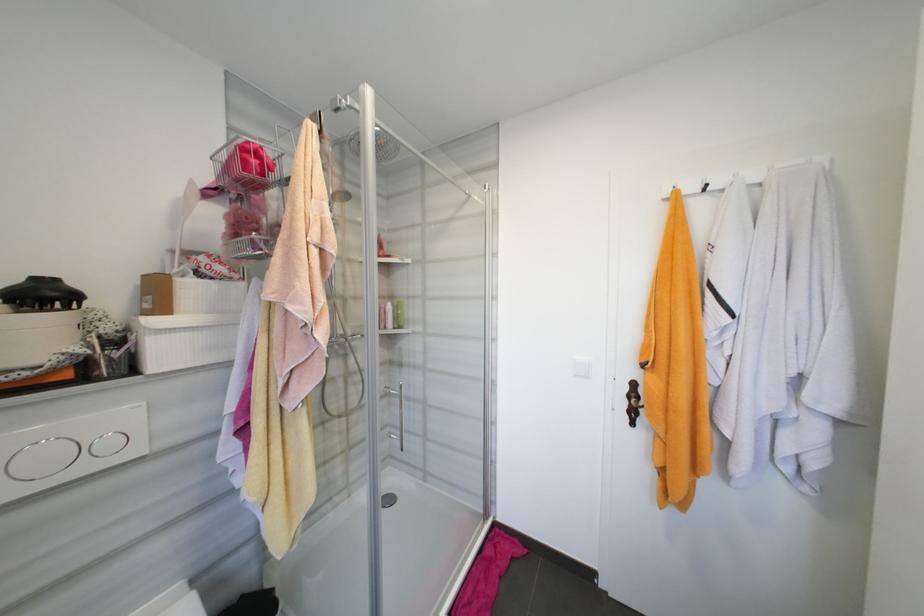
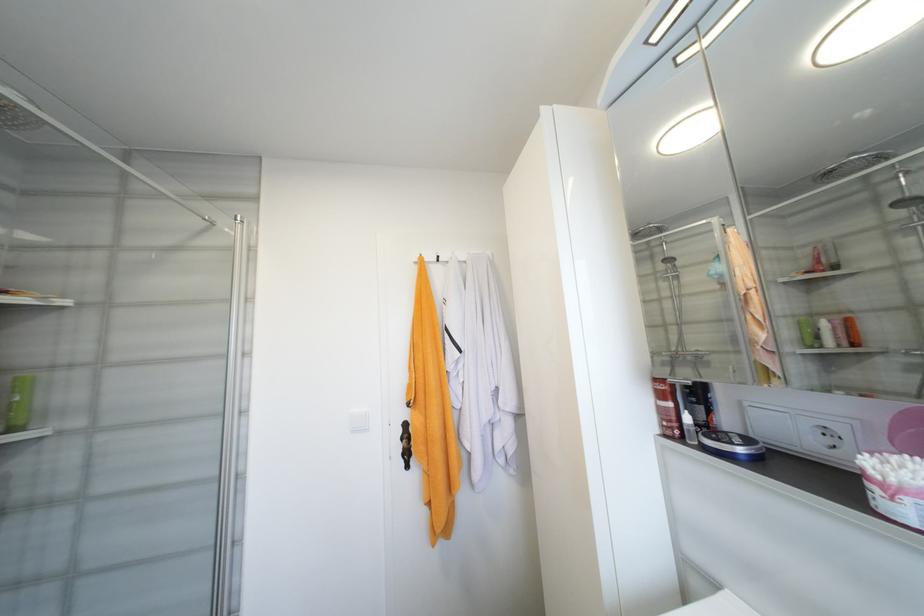
In the second image, find the point that corresponds to [712,185] in the first image.

(444, 257)